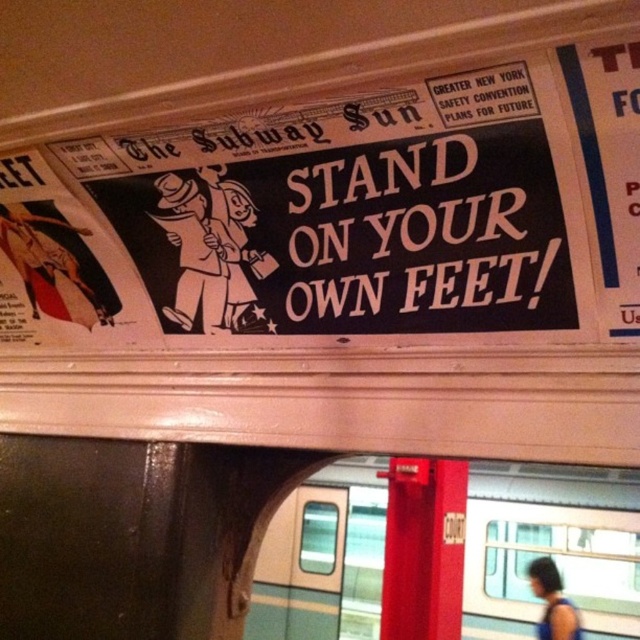
You are a passenger standing in the subway station and want to read both the white paper poster at upper right and the dark blue fabric at lower right. Which one will you need to look up higher to see?

The white paper poster at upper right is not as tall as the dark blue fabric at lower right, so you need to look up higher to see the dark blue fabric at lower right.

You are standing in the subway station and want to locate the teal glossy train at center. According to the coordinates provided, where would you look to find it?

The teal glossy train at center is located at coordinates point (x=550, y=548).

You are standing in the subway station and looking up at the ceiling. You notice two points marked on the ceiling. The first point is at coordinates point (x=340, y=612) and the second is at point (x=557, y=618). From your perspective, which point is closer to you?

Point (x=557, y=618) is closer to you because it is in front of point (x=340, y=612).